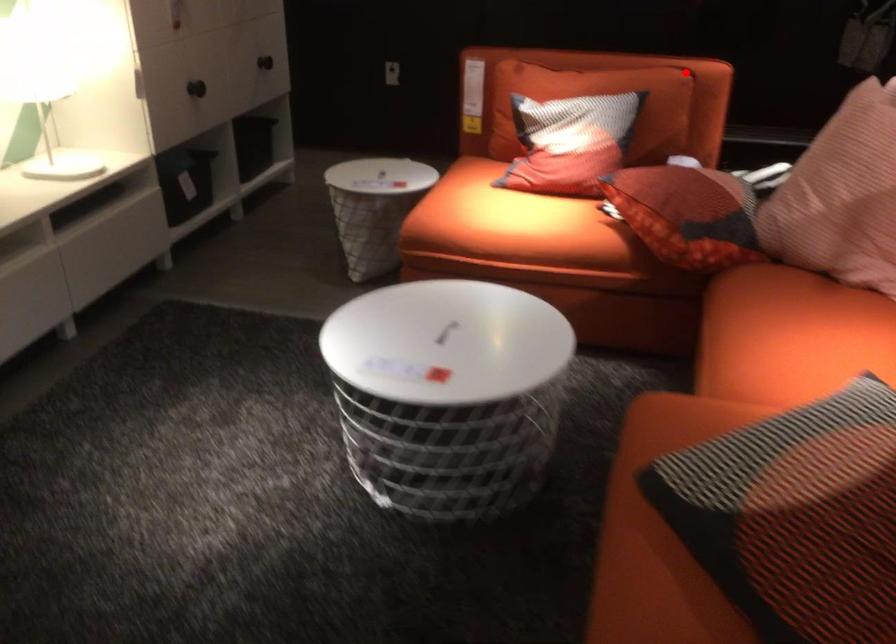
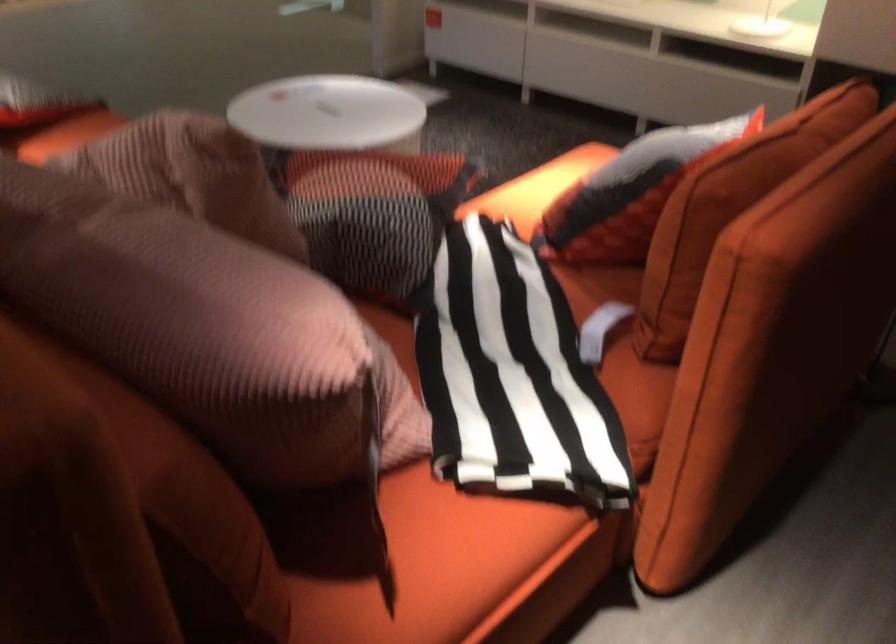
Question: I am providing you with two images of the same scene from different viewpoints. A red point is shown in image1. For the corresponding object point in image2, is it positioned nearer or farther from the camera?

Choices:
 (A) Nearer
 (B) Farther

Answer: (A)